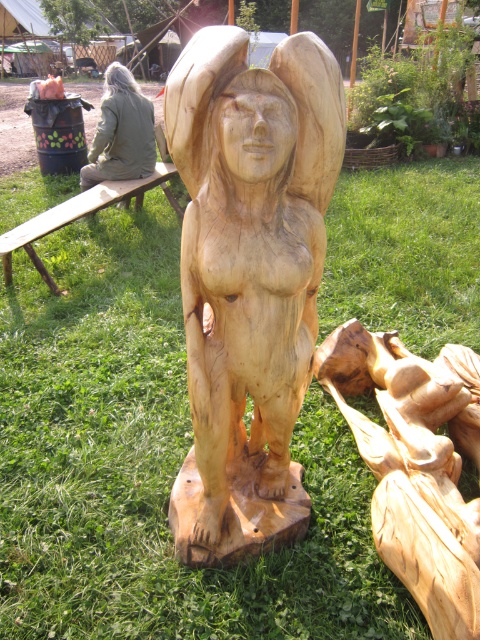
Question: Is natural wood statue at center bigger than green fabric jacket at left?

Choices:
 (A) yes
 (B) no

Answer: (A)

Question: Which of the following is the closest to the observer?

Choices:
 (A) (222, 198)
 (B) (388, 552)
 (C) (152, 122)

Answer: (A)

Question: Is natural wood carving at center above green fabric jacket at left?

Choices:
 (A) yes
 (B) no

Answer: (B)

Question: Is natural wood statue at center closer to the viewer compared to green fabric jacket at left?

Choices:
 (A) yes
 (B) no

Answer: (A)

Question: Based on their relative distances, which object is farther from the natural wood statue at center?

Choices:
 (A) green fabric jacket at left
 (B) natural wood carving at center

Answer: (A)

Question: Estimate the real-world distances between objects in this image. Which object is farther from the natural wood statue at center?

Choices:
 (A) green fabric jacket at left
 (B) natural wood carving at center

Answer: (A)